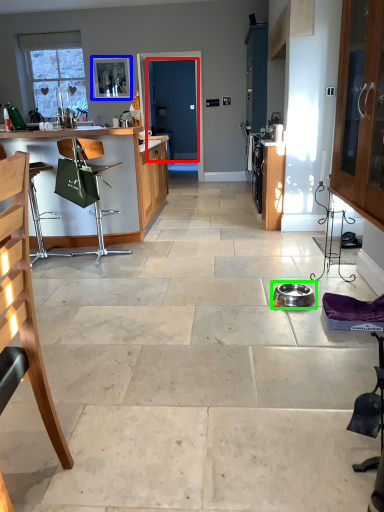
Question: Which object is positioned farthest from screen door (highlighted by a red box)? Select from picture frame (highlighted by a blue box) and appliance (highlighted by a green box).

Choices:
 (A) picture frame
 (B) appliance

Answer: (B)